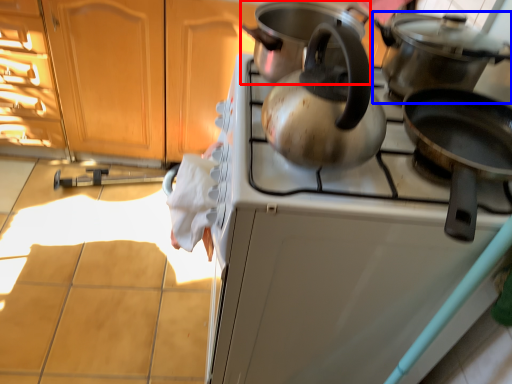
Question: Which object is closer to the camera taking this photo, kitchen appliance (highlighted by a red box) or kitchen appliance (highlighted by a blue box)?

Choices:
 (A) kitchen appliance
 (B) kitchen appliance

Answer: (B)